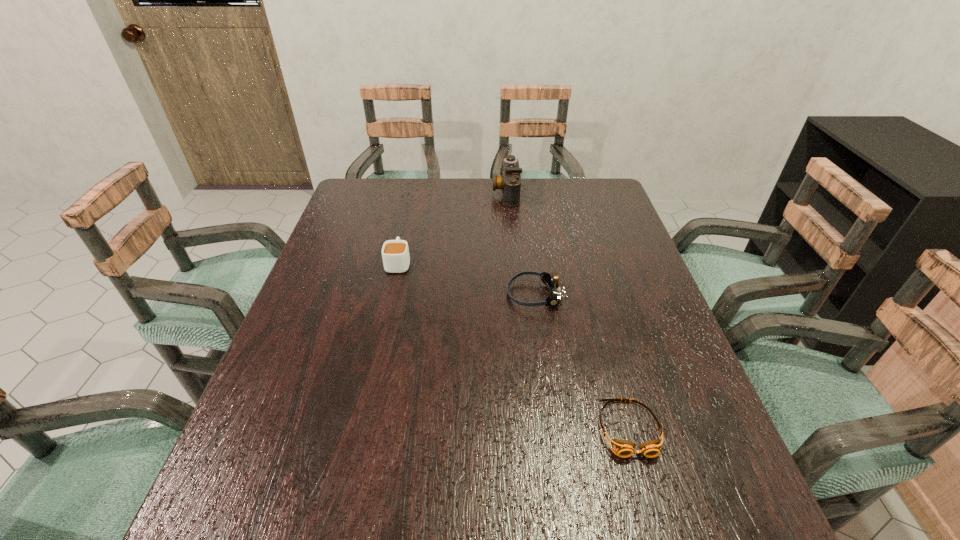
Image resolution: width=960 pixels, height=540 pixels. I want to click on the farthest object, so click(x=510, y=182).

The height and width of the screenshot is (540, 960). I want to click on the tallest object, so click(510, 182).

Where is `cup`? cup is located at coordinates (395, 253).

Locate an element on the screen. This screenshot has height=540, width=960. the third nearest object is located at coordinates (395, 253).

I want to click on the farther goggles, so click(x=551, y=281).

This screenshot has height=540, width=960. What are the coordinates of `the taller goggles` in the screenshot? It's located at (551, 281).

This screenshot has width=960, height=540. Find the location of `the shortest object`. the shortest object is located at coordinates (624, 449).

This screenshot has height=540, width=960. In order to click on the nearer goggles in this screenshot , I will do `click(624, 449)`.

This screenshot has width=960, height=540. What are the coordinates of `free space located on the lens of the farthest object` in the screenshot? It's located at (446, 192).

What are the coordinates of `free space located on the lens of the farthest object` in the screenshot? It's located at [435, 192].